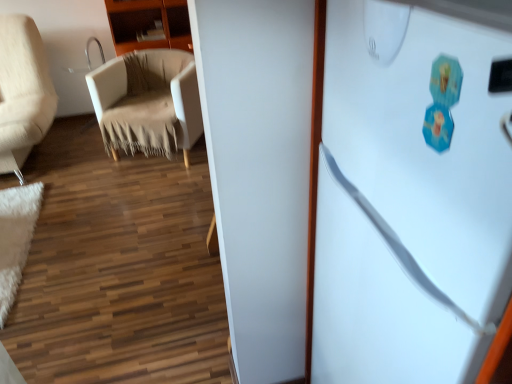
Question: From the image's perspective, is white fluffy mat at lower left below white matte refrigerator at right?

Choices:
 (A) yes
 (B) no

Answer: (B)

Question: Are white fluffy mat at lower left and white matte refrigerator at right far apart?

Choices:
 (A) yes
 (B) no

Answer: (A)

Question: Is white fluffy mat at lower left taller than white matte refrigerator at right?

Choices:
 (A) yes
 (B) no

Answer: (B)

Question: Is white fluffy mat at lower left located outside white matte refrigerator at right?

Choices:
 (A) yes
 (B) no

Answer: (A)

Question: Is white fluffy mat at lower left beside white matte refrigerator at right?

Choices:
 (A) yes
 (B) no

Answer: (B)

Question: Considering the relative positions of white fluffy mat at lower left and white matte refrigerator at right in the image provided, is white fluffy mat at lower left behind white matte refrigerator at right?

Choices:
 (A) yes
 (B) no

Answer: (A)

Question: From a real-world perspective, is white matte refrigerator at right positioned under wooden cabinet at upper left based on gravity?

Choices:
 (A) no
 (B) yes

Answer: (B)

Question: Is white matte refrigerator at right further to camera compared to wooden cabinet at upper left?

Choices:
 (A) no
 (B) yes

Answer: (A)

Question: Is white matte refrigerator at right smaller than wooden cabinet at upper left?

Choices:
 (A) no
 (B) yes

Answer: (A)

Question: Can you see white matte refrigerator at right touching wooden cabinet at upper left?

Choices:
 (A) no
 (B) yes

Answer: (A)

Question: From the image's perspective, is white matte refrigerator at right over wooden cabinet at upper left?

Choices:
 (A) yes
 (B) no

Answer: (B)

Question: Considering the relative sizes of white matte refrigerator at right and wooden cabinet at upper left in the image provided, is white matte refrigerator at right taller than wooden cabinet at upper left?

Choices:
 (A) no
 (B) yes

Answer: (B)

Question: Does white fluffy mat at lower left have a lesser height compared to wooden cabinet at upper left?

Choices:
 (A) no
 (B) yes

Answer: (B)